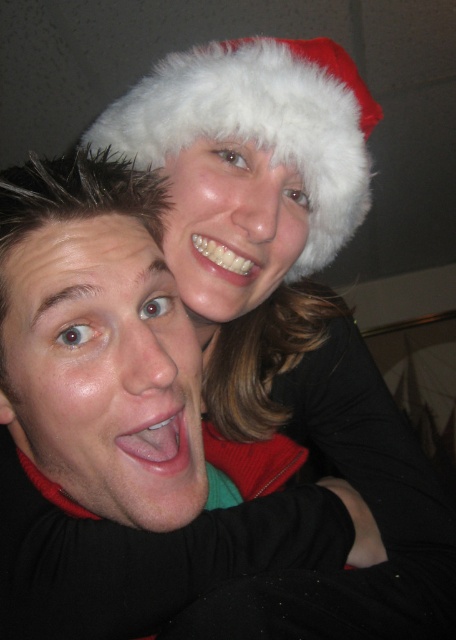
Question: Is matte black shirt at center thinner than white fluffy santa hat at upper center?

Choices:
 (A) yes
 (B) no

Answer: (B)

Question: Which point is farther from the camera taking this photo?

Choices:
 (A) (41, 253)
 (B) (174, 154)

Answer: (B)

Question: In this image, where is matte black shirt at center located relative to white fluffy santa hat at upper center?

Choices:
 (A) below
 (B) above

Answer: (A)

Question: Which of the following is the farthest from the observer?

Choices:
 (A) (42, 468)
 (B) (276, 116)

Answer: (B)

Question: Which point appears farthest from the camera in this image?

Choices:
 (A) (67, 339)
 (B) (350, 179)

Answer: (B)

Question: Is matte black shirt at center smaller than white fluffy santa hat at upper center?

Choices:
 (A) no
 (B) yes

Answer: (A)